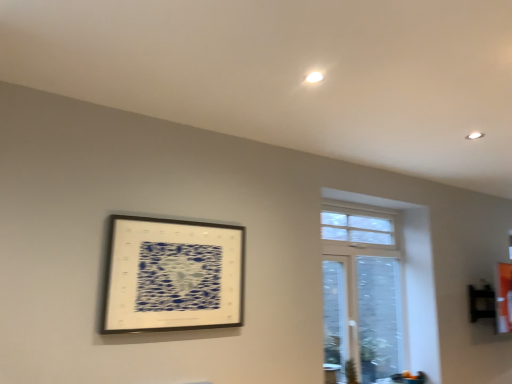
Question: Is point (330, 228) positioned closer to the camera than point (204, 302)?

Choices:
 (A) farther
 (B) closer

Answer: (A)

Question: From a real-world perspective, is white glass window at upper right physically located above or below metallic silver picture frame at upper left?

Choices:
 (A) below
 (B) above

Answer: (A)

Question: Which is correct: white glass window at upper right is inside metallic silver picture frame at upper left, or outside of it?

Choices:
 (A) inside
 (B) outside

Answer: (B)

Question: From the image's perspective, relative to white glass window at upper right, is metallic silver picture frame at upper left above or below?

Choices:
 (A) above
 (B) below

Answer: (A)

Question: Is metallic silver picture frame at upper left to the left or to the right of white glass window at upper right in the image?

Choices:
 (A) right
 (B) left

Answer: (B)

Question: In terms of height, does metallic silver picture frame at upper left look taller or shorter compared to white glass window at upper right?

Choices:
 (A) short
 (B) tall

Answer: (A)

Question: Choose the correct answer: Is metallic silver picture frame at upper left inside white glass window at upper right or outside it?

Choices:
 (A) inside
 (B) outside

Answer: (B)